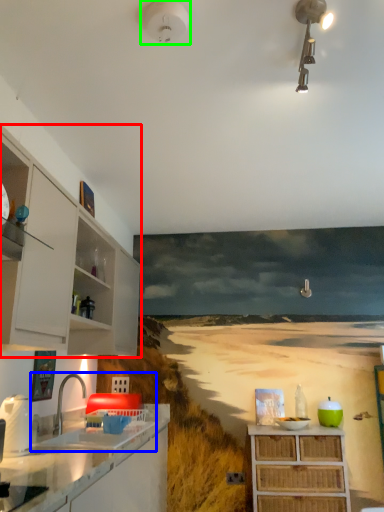
Question: Based on their relative distances, which object is farther from cabinetry (highlighted by a red box)? Choose from sink (highlighted by a blue box) and light fixture (highlighted by a green box).

Choices:
 (A) sink
 (B) light fixture

Answer: (B)